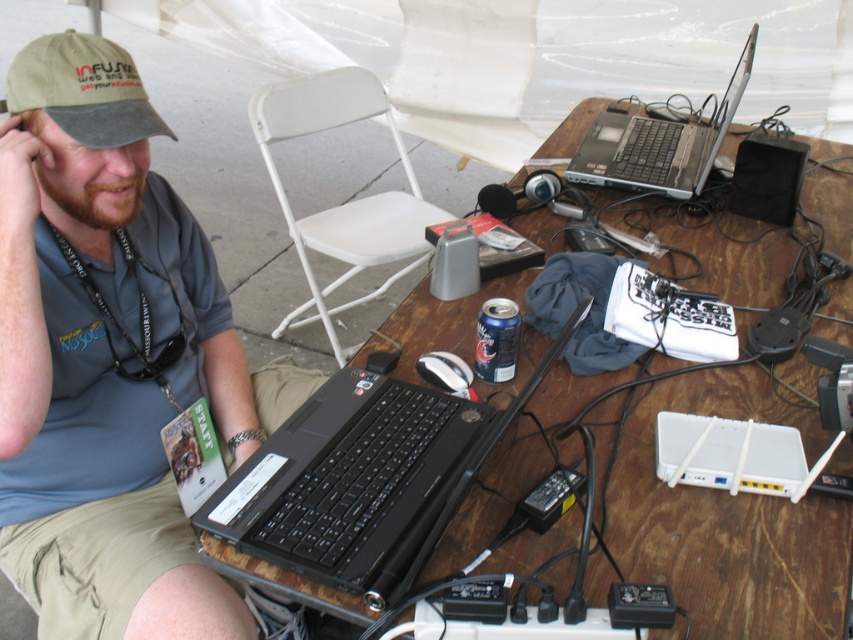
Question: Which object is the farthest from the matte black laptop at left?

Choices:
 (A) white plastic chair at center
 (B) black plastic laptop at center
 (C) khaki fabric baseball cap at left
 (D) wooden table at center

Answer: (A)

Question: Can you confirm if white plastic chair at center is positioned below khaki fabric baseball cap at left?

Choices:
 (A) no
 (B) yes

Answer: (A)

Question: Which of these objects is positioned closest to the black plastic laptop at center?

Choices:
 (A) white plastic chair at center
 (B) wooden table at center

Answer: (B)

Question: Which object appears farthest from the camera in this image?

Choices:
 (A) khaki fabric baseball cap at left
 (B) matte black laptop at left
 (C) white plastic chair at center

Answer: (C)

Question: Is khaki fabric baseball cap at left thinner than silver/black laptop at upper right?

Choices:
 (A) no
 (B) yes

Answer: (B)

Question: Can you confirm if wooden table at center is positioned above white plastic chair at center?

Choices:
 (A) yes
 (B) no

Answer: (B)